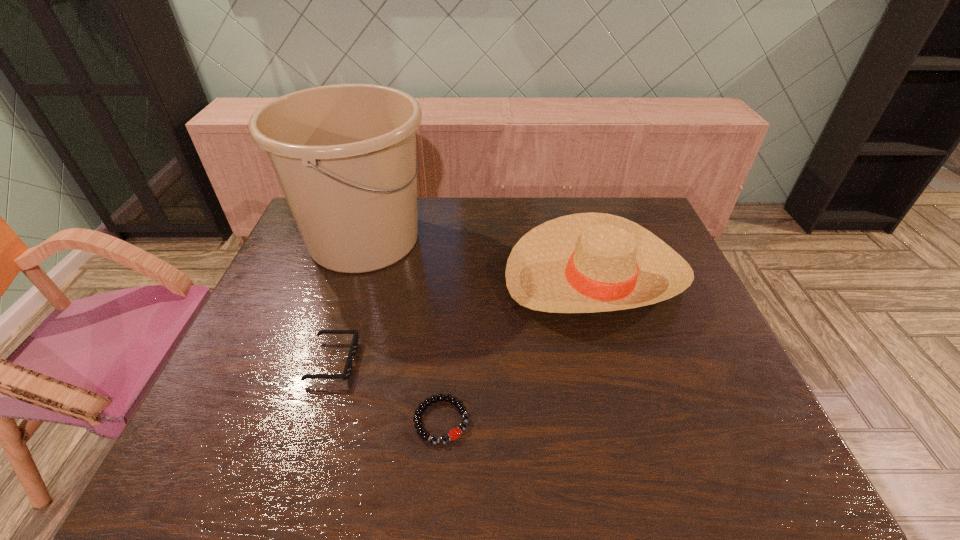
Locate an element on the screen. Image resolution: width=960 pixels, height=540 pixels. vacant space that satisfies the following two spatial constraints: 1. on the back side of the rightmost object; 2. on the right side of the nearest object is located at coordinates (452, 275).